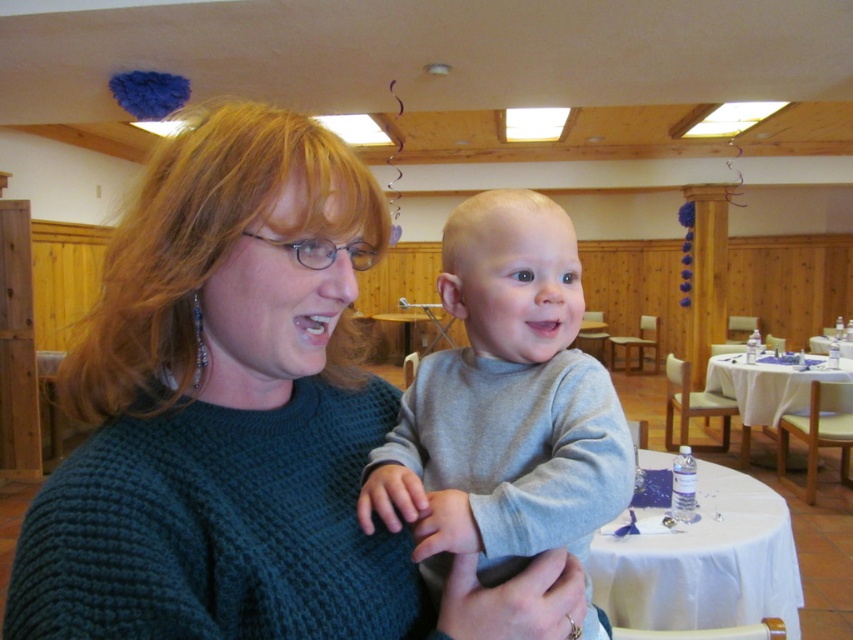
Is knitted dark green sweater at center bigger than gray cotton shirt at center?

Correct, knitted dark green sweater at center is larger in size than gray cotton shirt at center.

Does point (155, 301) come behind point (569, 225)?

No, it is in front of (569, 225).

Is point (276, 474) positioned before point (486, 253)?

Yes, point (276, 474) is closer to viewer.

Find the location of a particular element. Image resolution: width=853 pixels, height=640 pixels. knitted dark green sweater at center is located at coordinates pos(241,420).